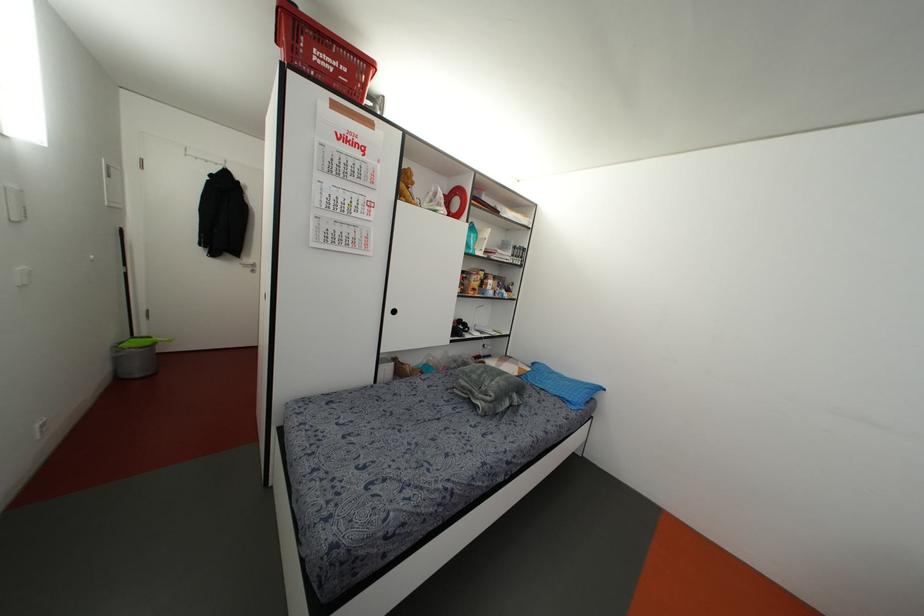
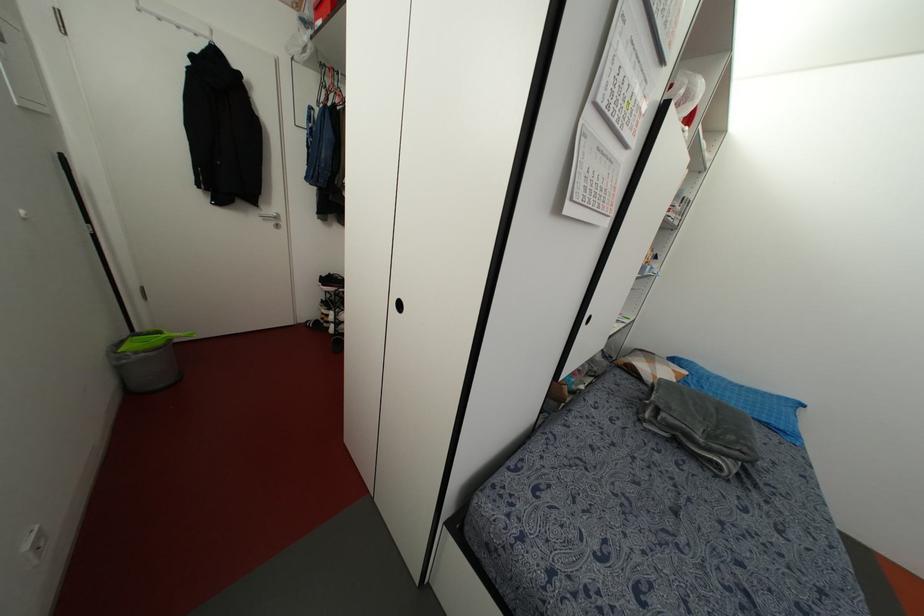
Find the pixel in the second image that matches point (153, 342) in the first image.

(168, 339)